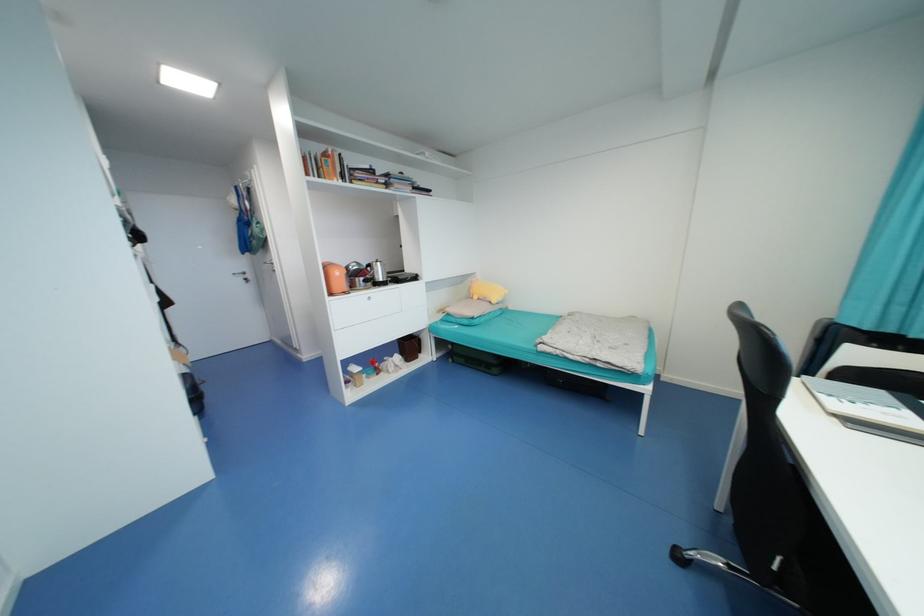
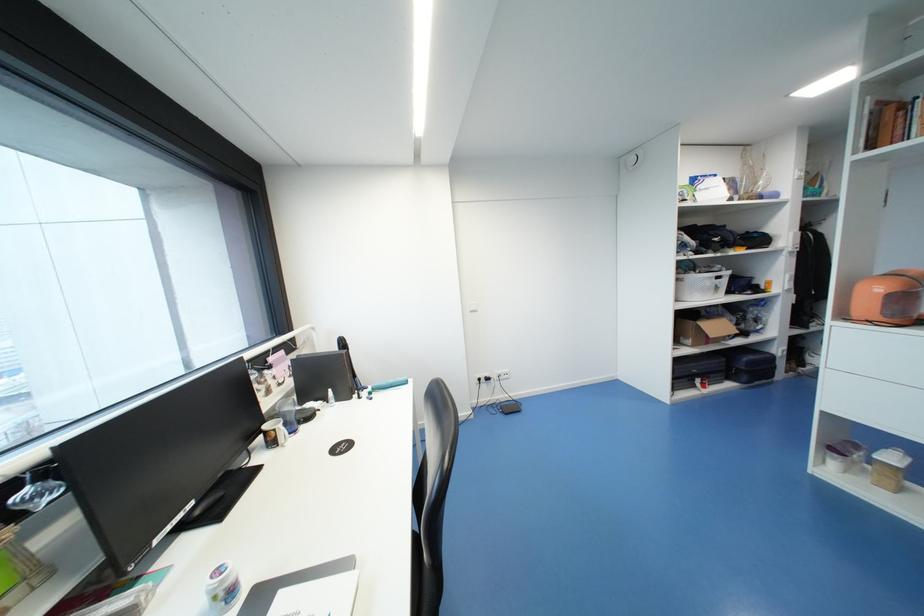
The point at (359, 370) is marked in the first image. Where is the corresponding point in the second image?

(897, 459)